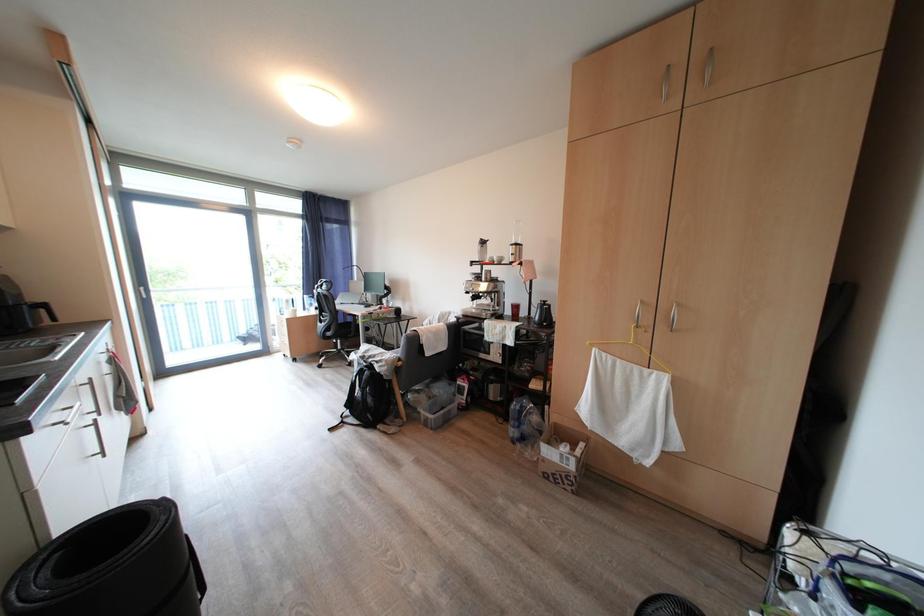
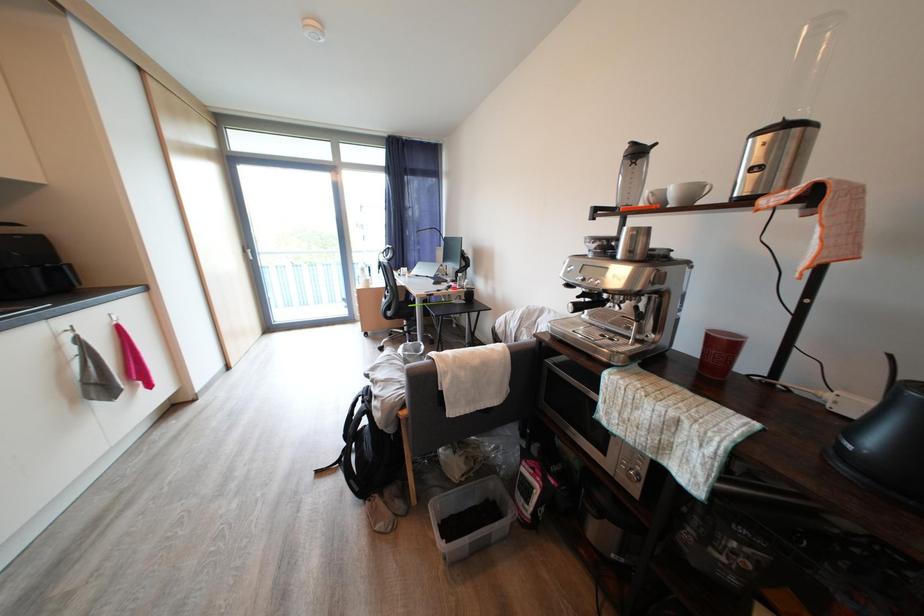
Question: The images are taken continuously from a first-person perspective. In which direction are you moving?

Choices:
 (A) Left
 (B) Right
 (C) Forward
 (D) Backward

Answer: (C)